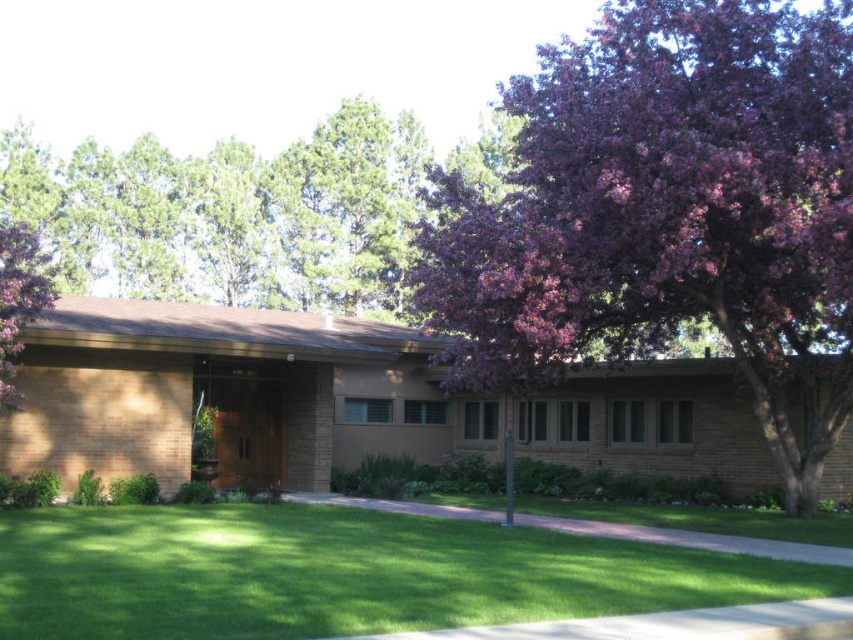
Is purple leafy tree at upper right further to the viewer compared to green grass at lower center?

Yes, purple leafy tree at upper right is further from the viewer.

Consider the image. Between purple leafy tree at upper right and green grass at lower center, which one has more height?

purple leafy tree at upper right is taller.

Between point (851, 324) and point (453, 554), which one is positioned in front?

Positioned in front is point (453, 554).

At what (x,y) coordinates should I click in order to perform the action: click on purple leafy tree at upper right. Please return your answer as a coordinate pair (x, y). Looking at the image, I should click on (668, 212).

Does purple leafy tree at upper right have a greater width compared to green leafy tree at upper center?

In fact, purple leafy tree at upper right might be narrower than green leafy tree at upper center.

The image size is (853, 640). I want to click on purple leafy tree at upper right, so click(x=668, y=212).

How much distance is there between green grass at lower center and purple leafy tree at upper left?

They are 6.25 meters apart.

Is green grass at lower center further to camera compared to purple leafy tree at upper left?

No, it is not.

Is point (544, 596) behind point (3, 308)?

No, (544, 596) is closer to viewer.

At what (x,y) coordinates should I click in order to perform the action: click on green grass at lower center. Please return your answer as a coordinate pair (x, y). This screenshot has width=853, height=640. Looking at the image, I should click on (343, 573).